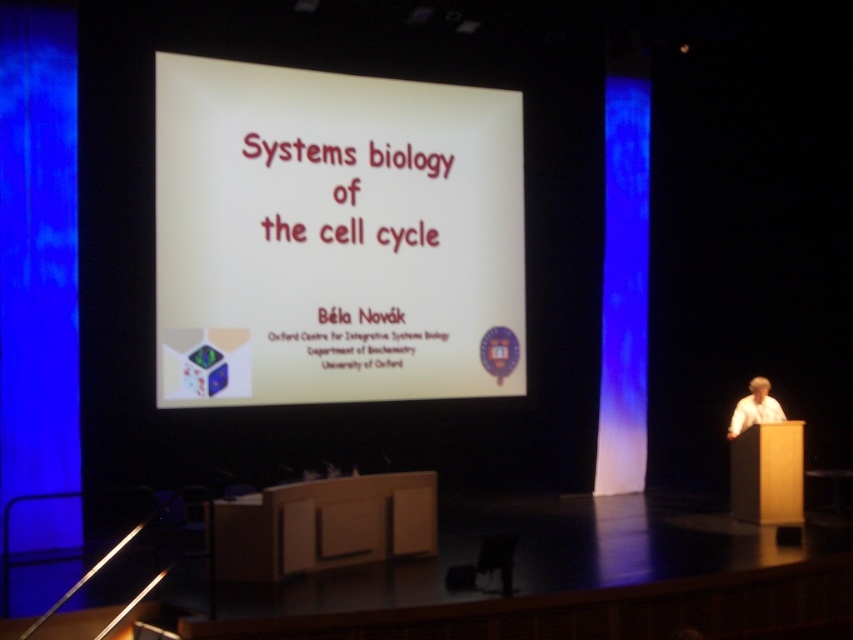
Question: In this image, where is white paper at center located relative to white paper at right?

Choices:
 (A) below
 (B) above

Answer: (B)

Question: Among these points, which one is nearest to the camera?

Choices:
 (A) 763,378
 (B) 190,145

Answer: (B)

Question: Among these points, which one is farthest from the camera?

Choices:
 (A) (271, 353)
 (B) (769, 396)

Answer: (B)

Question: Is white paper at center to the right of white paper at right from the viewer's perspective?

Choices:
 (A) no
 (B) yes

Answer: (A)

Question: Can you confirm if white paper at center is positioned to the right of white paper at right?

Choices:
 (A) no
 (B) yes

Answer: (A)